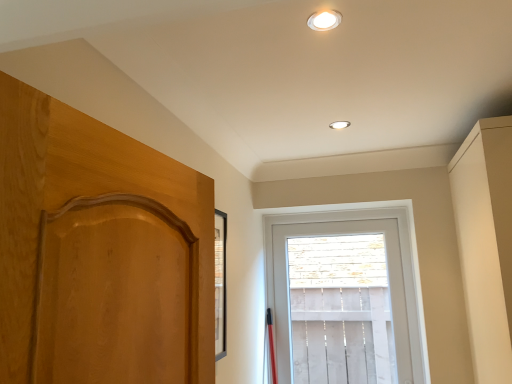
Question: Should I look upward or downward to see matte beige dresser at right?

Choices:
 (A) down
 (B) up

Answer: (A)

Question: Is white glossy recessed light at upper center, the second lighting when ordered from right to left, facing away from white wooden window at center?

Choices:
 (A) no
 (B) yes

Answer: (A)

Question: Is the depth of white glossy recessed light at upper center, which is counted as the second lighting, starting from the bottom, greater than that of white wooden window at center?

Choices:
 (A) no
 (B) yes

Answer: (A)

Question: From the image's perspective, does white glossy recessed light at upper center, the 1th lighting positioned from the front, appear lower than white wooden window at center?

Choices:
 (A) no
 (B) yes

Answer: (A)

Question: Does white glossy recessed light at upper center, which ranks as the 1th lighting in left-to-right order, appear on the right side of white wooden window at center?

Choices:
 (A) yes
 (B) no

Answer: (B)

Question: From the image's perspective, is white glossy recessed light at upper center, arranged as the 1th lighting when viewed from the top, located above white wooden window at center?

Choices:
 (A) no
 (B) yes

Answer: (B)

Question: Is white glossy recessed light at upper center, which ranks as the 1th lighting in left-to-right order, not within white wooden window at center?

Choices:
 (A) yes
 (B) no

Answer: (A)

Question: From the image's perspective, would you say white wooden window at center is shown under white glossy recessed light at upper center, the second lighting when ordered from right to left?

Choices:
 (A) yes
 (B) no

Answer: (A)

Question: Can you confirm if white wooden window at center is positioned to the right of white glossy recessed light at upper center, the second lighting when ordered from right to left?

Choices:
 (A) no
 (B) yes

Answer: (B)

Question: Considering the relative sizes of white wooden window at center and white glossy recessed light at upper center, which ranks as the 1th lighting in left-to-right order, in the image provided, is white wooden window at center smaller than white glossy recessed light at upper center, which ranks as the 1th lighting in left-to-right order,?

Choices:
 (A) no
 (B) yes

Answer: (A)

Question: Is white wooden window at center thinner than white glossy recessed light at upper center, arranged as the 1th lighting when viewed from the top?

Choices:
 (A) yes
 (B) no

Answer: (B)

Question: Is the depth of white wooden window at center greater than that of white glossy recessed light at upper center, arranged as the 1th lighting when viewed from the top?

Choices:
 (A) no
 (B) yes

Answer: (B)

Question: Is white wooden window at center aimed at white glossy recessed light at upper center, arranged as the 1th lighting when viewed from the top?

Choices:
 (A) yes
 (B) no

Answer: (A)

Question: From a real-world perspective, is white glossy light fixture at upper center, acting as the first lighting starting from the right, under matte beige dresser at right?

Choices:
 (A) no
 (B) yes

Answer: (A)